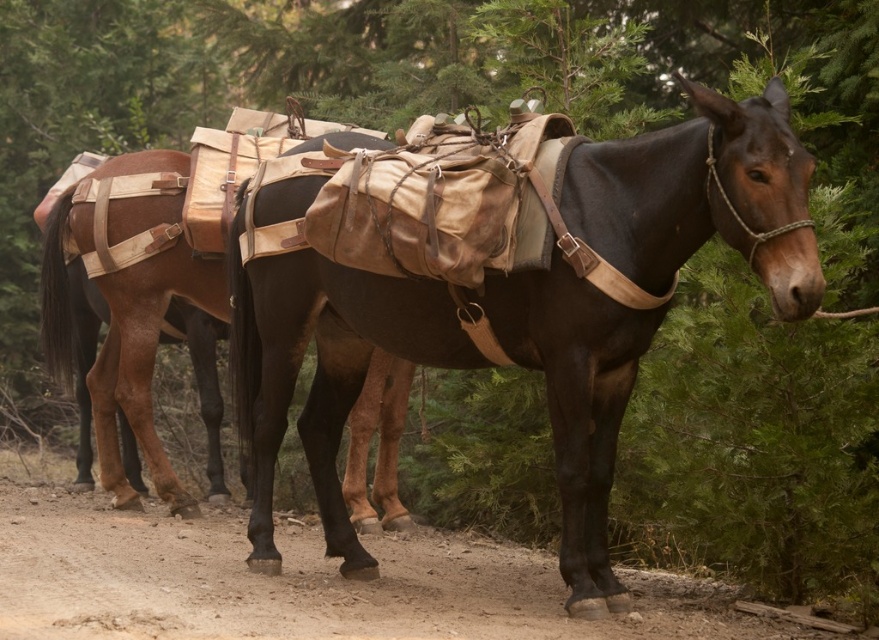
You are standing in a forest path where two mules are loaded with supplies. You need to reach the brown leather saddle at center to adjust its straps. Considering your height is 1.7 meters, can you comfortably reach the saddle without climbing onto anything?

The brown leather saddle at center is 4.91 meters away from you. Since this distance is greater than your height of 1.7 meters, you cannot comfortably reach the saddle without climbing onto something.

In the scene shown: You are a hiker trying to navigate through the forest path. You see two points marked in the image. Which point is closer to you, the point at coordinates (761, 276) or the point at (102, 515)?

Point (761, 276) is in front of point (102, 515), so the point at (761, 276) is closer to you.

You are a hiker planning to cross the dirt path shown in the image. You have a backpack that is 0.5 meters wide. Can your backpack fit on the dusty brown dirt track at center without overlapping the brown leather saddle at center?

The brown leather saddle at center is bigger than the dusty brown dirt track at center. Since the saddle is larger, the dirt track is narrower. Your backpack is 0.5 meters wide, so it might not fit without overlapping the saddle if the track is too narrow.